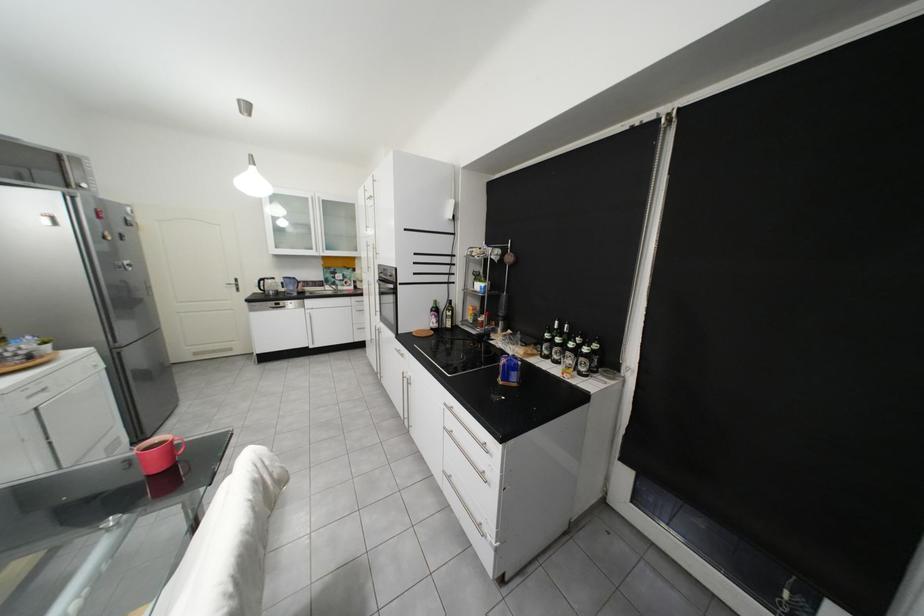
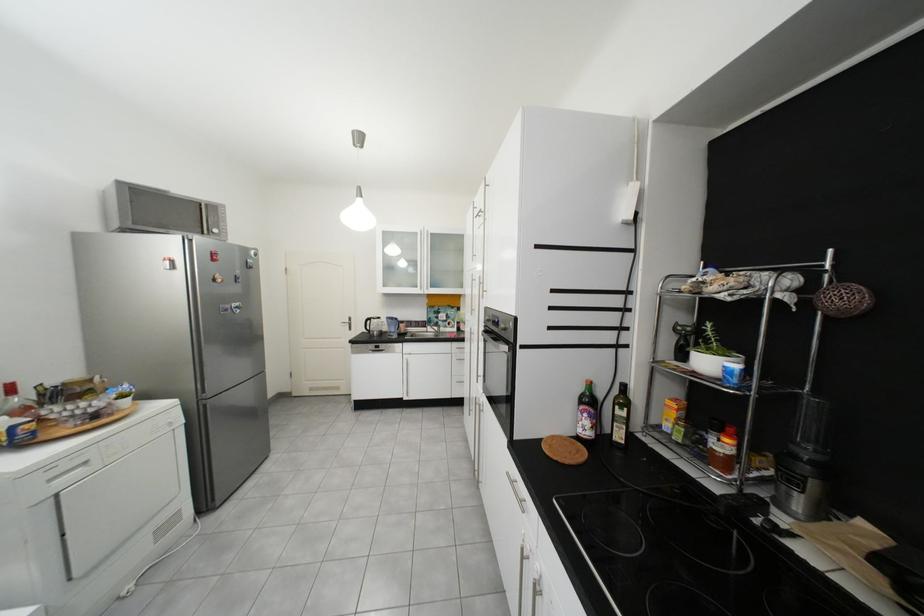
Locate, in the second image, the point that corresponds to point 322,285 in the first image.

(426, 325)